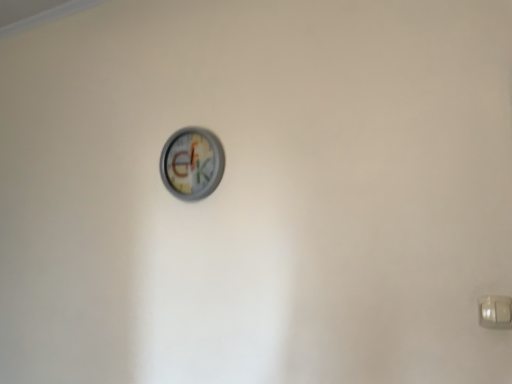
Question: Is white plastic door handle at lower right thinner than metallic gray clock at center?

Choices:
 (A) no
 (B) yes

Answer: (B)

Question: Is white plastic door handle at lower right wider than metallic gray clock at center?

Choices:
 (A) no
 (B) yes

Answer: (A)

Question: From the image's perspective, does white plastic door handle at lower right appear lower than metallic gray clock at center?

Choices:
 (A) no
 (B) yes

Answer: (B)

Question: Would you say white plastic door handle at lower right is a long distance from metallic gray clock at center?

Choices:
 (A) yes
 (B) no

Answer: (B)

Question: Is white plastic door handle at lower right oriented towards metallic gray clock at center?

Choices:
 (A) yes
 (B) no

Answer: (B)

Question: Is white plastic door handle at lower right completely or partially outside of metallic gray clock at center?

Choices:
 (A) yes
 (B) no

Answer: (A)

Question: From the image's perspective, is metallic gray clock at center located beneath white plastic door handle at lower right?

Choices:
 (A) yes
 (B) no

Answer: (B)

Question: Is metallic gray clock at center bigger than white plastic door handle at lower right?

Choices:
 (A) yes
 (B) no

Answer: (A)

Question: Is metallic gray clock at center taller than white plastic door handle at lower right?

Choices:
 (A) yes
 (B) no

Answer: (A)

Question: Is metallic gray clock at center positioned beyond the bounds of white plastic door handle at lower right?

Choices:
 (A) no
 (B) yes

Answer: (B)

Question: Is metallic gray clock at center shorter than white plastic door handle at lower right?

Choices:
 (A) yes
 (B) no

Answer: (B)

Question: Is metallic gray clock at center looking in the opposite direction of white plastic door handle at lower right?

Choices:
 (A) no
 (B) yes

Answer: (A)

Question: In terms of width, does metallic gray clock at center look wider or thinner when compared to white plastic door handle at lower right?

Choices:
 (A) thin
 (B) wide

Answer: (B)